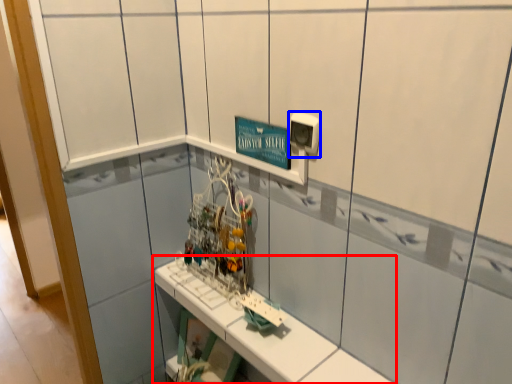
Question: Which point is further to the camera, shelf (highlighted by a red box) or electric outlet (highlighted by a blue box)?

Choices:
 (A) shelf
 (B) electric outlet

Answer: (B)